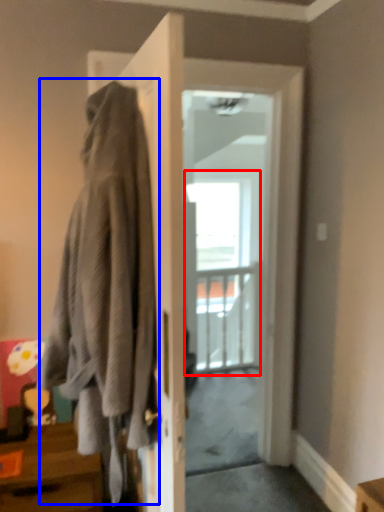
Question: Which point is further to the camera, glass door (highlighted by a red box) or laundry (highlighted by a blue box)?

Choices:
 (A) glass door
 (B) laundry

Answer: (A)